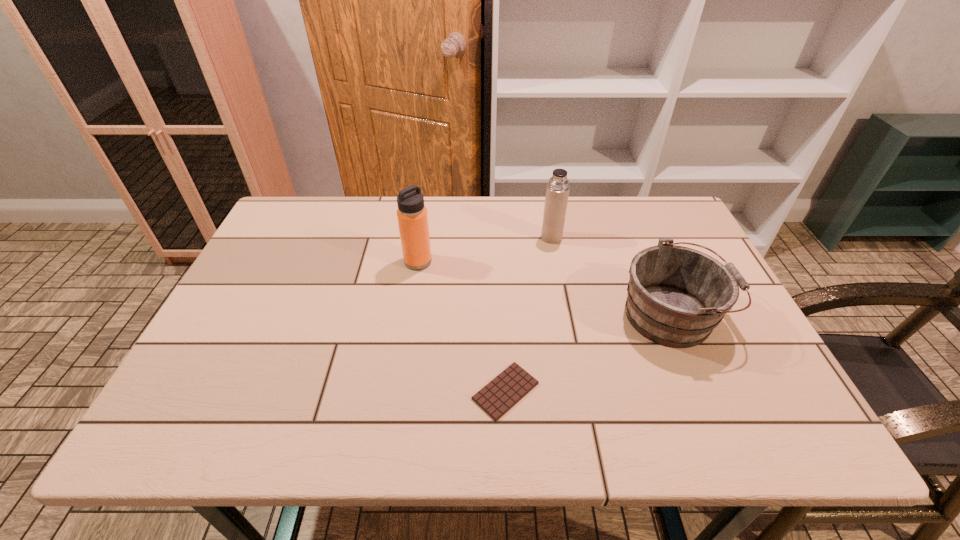
Locate an element on the screen. This screenshot has height=540, width=960. vacant area located 0.150m on the left of the second nearest object is located at coordinates (559, 316).

Image resolution: width=960 pixels, height=540 pixels. What are the coordinates of `vacant area situated on the left of the third object from right to left` in the screenshot? It's located at (416, 391).

At what (x,y) coordinates should I click in order to perform the action: click on object located at the far edge. Please return your answer as a coordinate pair (x, y). The width and height of the screenshot is (960, 540). Looking at the image, I should click on (557, 192).

Identify the location of object that is at the near edge. (505, 390).

You are a GUI agent. You are given a task and a screenshot of the screen. Output one action in this format:
    pyautogui.click(x=<x>, y=<y>)
    Task: Click on the object located in the right edge section of the desktop
    Image resolution: width=960 pixels, height=540 pixels.
    Given the screenshot: What is the action you would take?
    676,296

In the image, there is a desktop. Where is `vacant space at the far edge`? vacant space at the far edge is located at coordinates (591, 198).

At what (x,y) coordinates should I click in order to perform the action: click on vacant space at the near edge of the desktop. Please return your answer as a coordinate pair (x, y). This screenshot has width=960, height=540. Looking at the image, I should click on (624, 409).

In the image, there is a desktop. Where is `vacant space at the left edge`? This screenshot has height=540, width=960. vacant space at the left edge is located at coordinates (276, 325).

In the image, there is a desktop. Identify the location of vacant space at the right edge. The image size is (960, 540). (748, 378).

Identify the location of vacant area at the far right corner. (651, 197).